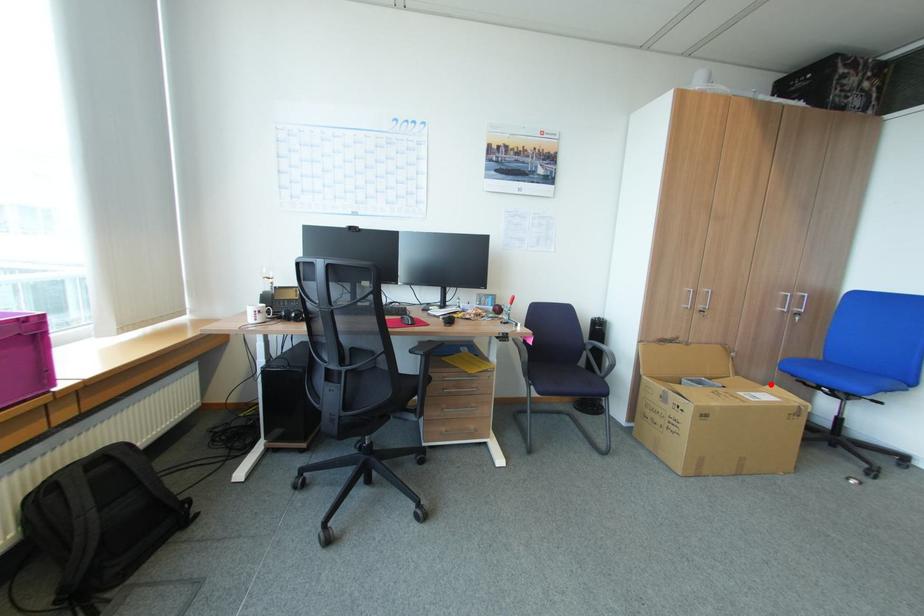
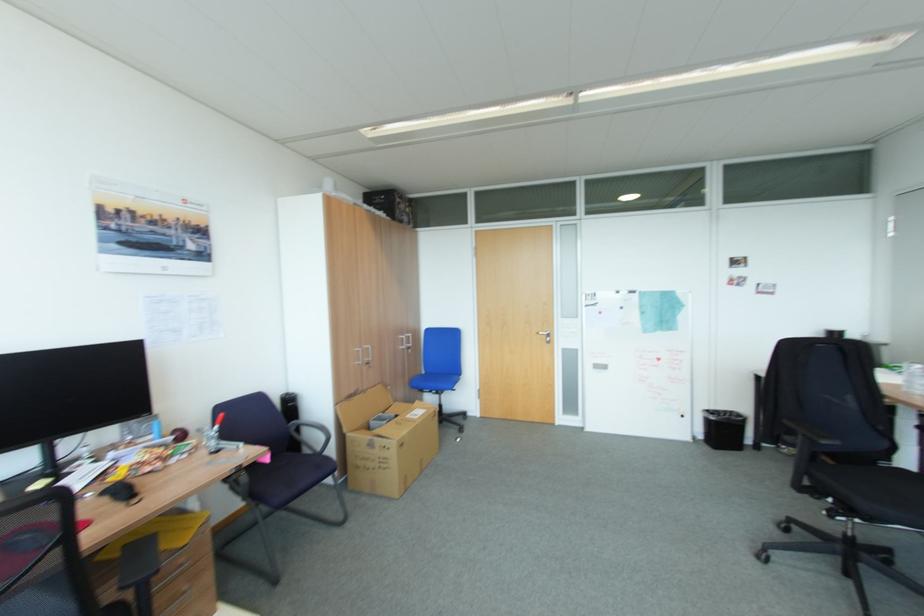
Question: I am providing you with two images of the same scene from different viewpoints. A red point is marked on the first image. At the location where the point appears in image 1, is it still visible in image 2?

Choices:
 (A) Yes
 (B) No

Answer: (A)